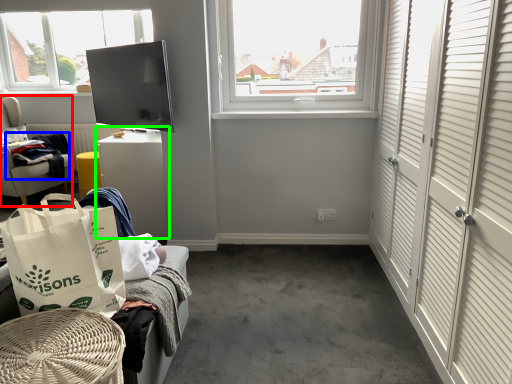
Question: Which object is positioned closest to furniture (highlighted by a red box)? Select from clothing (highlighted by a blue box) and table (highlighted by a green box).

Choices:
 (A) clothing
 (B) table

Answer: (A)